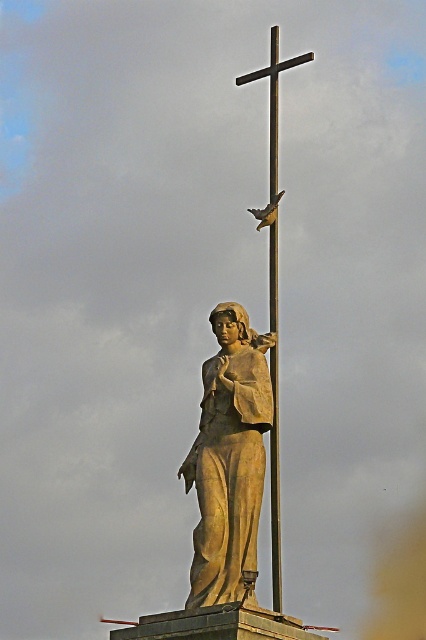
Question: Is matte bronze statue at center thinner than matte gray bird at center?

Choices:
 (A) no
 (B) yes

Answer: (A)

Question: Observing the image, what is the correct spatial positioning of matte bronze statue at center in reference to matte gray bird at center?

Choices:
 (A) right
 (B) left

Answer: (B)

Question: Does matte bronze statue at center lie behind matte gray bird at center?

Choices:
 (A) yes
 (B) no

Answer: (B)

Question: Among these objects, which one is farthest from the camera?

Choices:
 (A) matte bronze statue at center
 (B) matte gray bird at center

Answer: (B)

Question: Which point appears closest to the camera in this image?

Choices:
 (A) (244, 516)
 (B) (270, 216)

Answer: (A)

Question: Which of the following is the farthest from the observer?

Choices:
 (A) matte gray bird at center
 (B) matte bronze statue at center

Answer: (A)